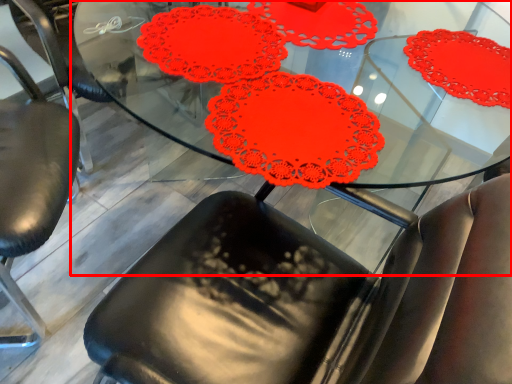
Question: From the image's perspective, considering the relative positions of table (annotated by the red box) and chair in the image provided, where is table (annotated by the red box) located with respect to the staircase?

Choices:
 (A) below
 (B) above

Answer: (A)